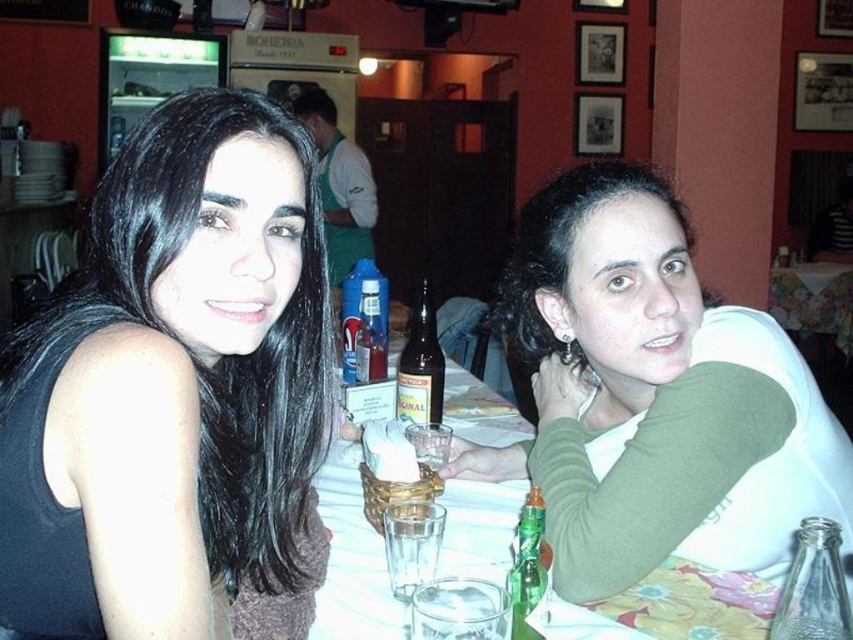
You are at a table in a casual dining establishment and want to place a napkin on the table. The green matte shirt at upper right is represented by point (653, 396). Where should you place the napkin so it is closest to the green matte shirt at upper right without being on the person?

Place the napkin near the edge of the table closest to the green matte shirt at upper right, but not touching the person.

Based on the photo, you are a server at the restaurant and need to place a new drink order on the table between the two people. The drink order is a large tray that requires 24 inches of space. Can you fit the tray between the transparent glass bottle at lower right and the person on the left?

The transparent glass bottle at lower right and the person on the left are 22.40 inches apart. Since the required space for the tray is 24 inches, which is larger than the available 22.40 inches, the tray cannot be placed between them.

You are a photographer taking a picture of the green matte shirt at upper right and the brown glass bottle at center. Which object should you focus on first if you want to capture both clearly in the same frame?

The green matte shirt at upper right is below the brown glass bottle at center, so you should focus on the brown glass bottle at center first to ensure both are in focus.